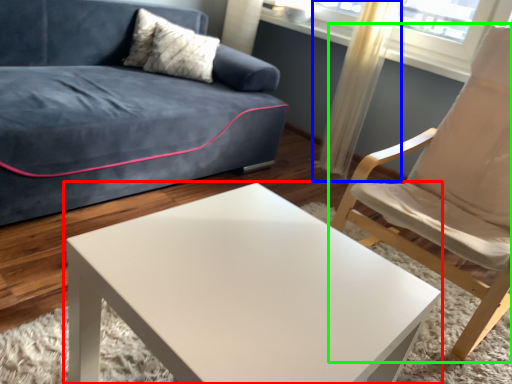
Question: Which object is the closest to the coffee table (highlighted by a red box)? Choose among these: curtain (highlighted by a blue box) or chair (highlighted by a green box).

Choices:
 (A) curtain
 (B) chair

Answer: (B)